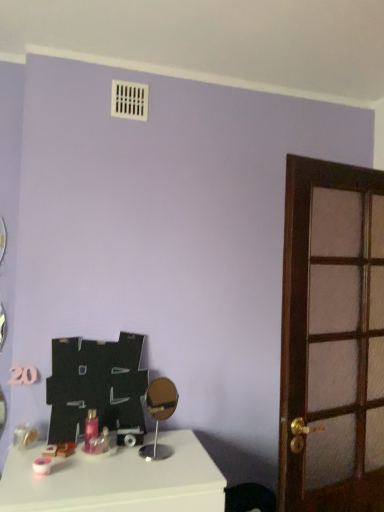
Question: Should I look upward or downward to see pink glossy bottle at center?

Choices:
 (A) down
 (B) up

Answer: (A)

Question: Considering the relative sizes of pink glossy bottle at center and white glossy table at lower left in the image provided, is pink glossy bottle at center smaller than white glossy table at lower left?

Choices:
 (A) no
 (B) yes

Answer: (B)

Question: Is white glossy table at lower left a part of pink glossy bottle at center?

Choices:
 (A) yes
 (B) no

Answer: (B)

Question: Considering the relative sizes of pink glossy bottle at center and white glossy table at lower left in the image provided, is pink glossy bottle at center bigger than white glossy table at lower left?

Choices:
 (A) yes
 (B) no

Answer: (B)

Question: Is pink glossy bottle at center not within white glossy table at lower left?

Choices:
 (A) yes
 (B) no

Answer: (A)

Question: Does pink glossy bottle at center have a greater width compared to white glossy table at lower left?

Choices:
 (A) no
 (B) yes

Answer: (A)

Question: Is pink glossy bottle at center positioned before white glossy table at lower left?

Choices:
 (A) yes
 (B) no

Answer: (B)

Question: From the image's perspective, is gold metallic mirror at center below pink glossy bottle at center?

Choices:
 (A) no
 (B) yes

Answer: (A)

Question: From a real-world perspective, is gold metallic mirror at center physically below pink glossy bottle at center?

Choices:
 (A) yes
 (B) no

Answer: (B)

Question: Is gold metallic mirror at center far away from pink glossy bottle at center?

Choices:
 (A) yes
 (B) no

Answer: (B)

Question: Can you confirm if gold metallic mirror at center is positioned to the left of pink glossy bottle at center?

Choices:
 (A) yes
 (B) no

Answer: (B)

Question: Is gold metallic mirror at center aimed at pink glossy bottle at center?

Choices:
 (A) yes
 (B) no

Answer: (B)

Question: Does gold metallic mirror at center contain pink glossy bottle at center?

Choices:
 (A) no
 (B) yes

Answer: (A)

Question: Would you say brown wooden door at right contains gold metallic mirror at center?

Choices:
 (A) yes
 (B) no

Answer: (B)